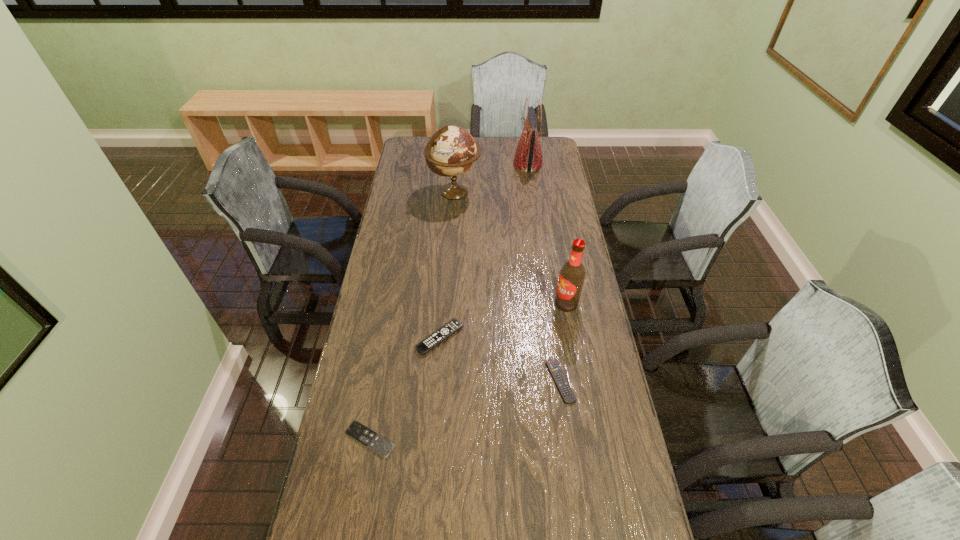
The height and width of the screenshot is (540, 960). Identify the location of the second farthest object. click(x=452, y=150).

Where is `handbag`? Image resolution: width=960 pixels, height=540 pixels. handbag is located at coordinates (528, 157).

You are a GUI agent. You are given a task and a screenshot of the screen. Output one action in this format:
    pyautogui.click(x=<x>, y=<y>)
    Task: Click on the fourth nearest object
    
    Given the screenshot: What is the action you would take?
    pyautogui.click(x=572, y=274)

Where is `the third shortest object`? This screenshot has width=960, height=540. the third shortest object is located at coordinates (454, 325).

What are the coordinates of `the farthest remote control` in the screenshot? It's located at (454, 325).

Identify the location of the second shortest object. The width and height of the screenshot is (960, 540). (554, 368).

At what (x,y) coordinates should I click in order to perform the action: click on the rightmost remote control. Please return your answer as a coordinate pair (x, y). The height and width of the screenshot is (540, 960). Looking at the image, I should click on (554, 368).

I want to click on the leftmost remote control, so click(x=365, y=436).

Where is `the shortest object`? The height and width of the screenshot is (540, 960). the shortest object is located at coordinates (365, 436).

This screenshot has width=960, height=540. What are the coordinates of `free space located 0.270m on the front of the globe showing Asia` in the screenshot? It's located at (542, 192).